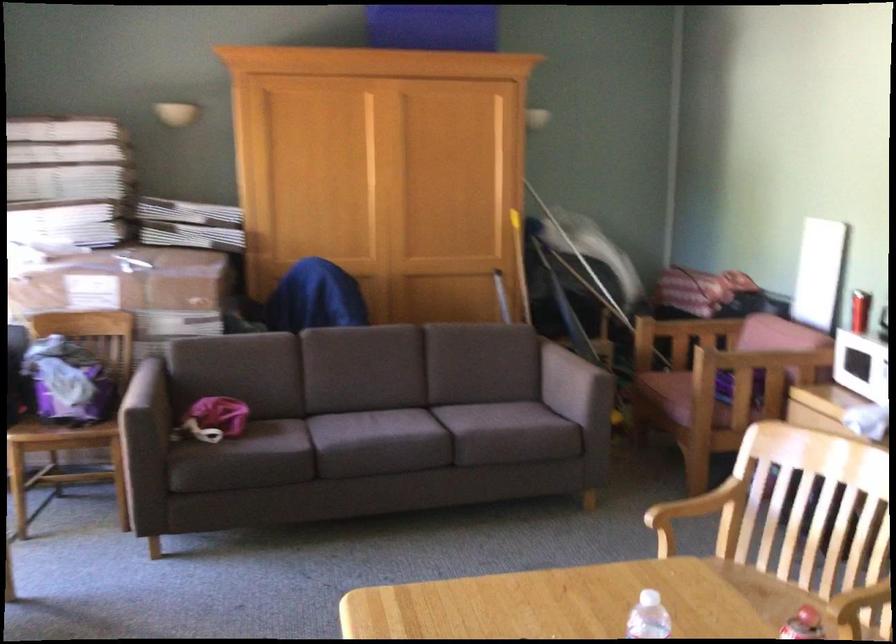
Which object does [131,290] point to?

It refers to a large cardboard box.